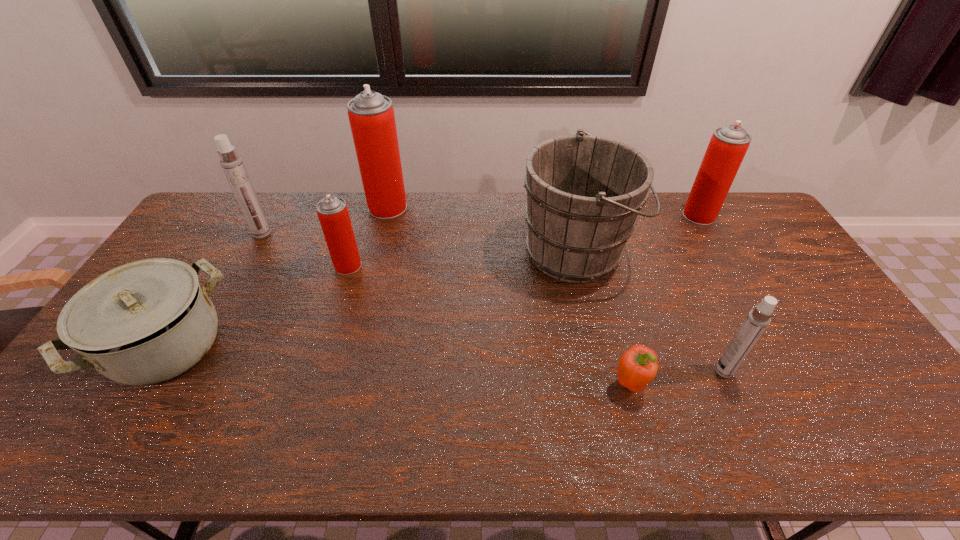
At what (x,y) coordinates should I click in order to perform the action: click on vacant space situated on the right of the saucepan. Please return your answer as a coordinate pair (x, y). The width and height of the screenshot is (960, 540). Looking at the image, I should click on (284, 346).

Image resolution: width=960 pixels, height=540 pixels. What are the coordinates of `free space located on the right of the pepper` in the screenshot? It's located at (699, 384).

In order to click on bucket that is at the far edge in this screenshot , I will do `click(584, 192)`.

The image size is (960, 540). Identify the location of object that is at the left edge. (144, 322).

Identify the location of vacant space at the far edge of the desktop. (681, 206).

In the image, there is a desktop. At what (x,y) coordinates should I click in order to perform the action: click on free region at the near edge. Please return your answer as a coordinate pair (x, y). The height and width of the screenshot is (540, 960). Looking at the image, I should click on (837, 443).

The height and width of the screenshot is (540, 960). In the image, there is a desktop. What are the coordinates of `free space at the left edge` in the screenshot? It's located at (212, 248).

In order to click on vacant position at the right edge of the desktop in this screenshot , I will do (x=807, y=320).

In the image, there is a desktop. Identify the location of free region at the far left corner. (232, 226).

The height and width of the screenshot is (540, 960). I want to click on unoccupied position between the rightmost object and the pepper, so click(664, 300).